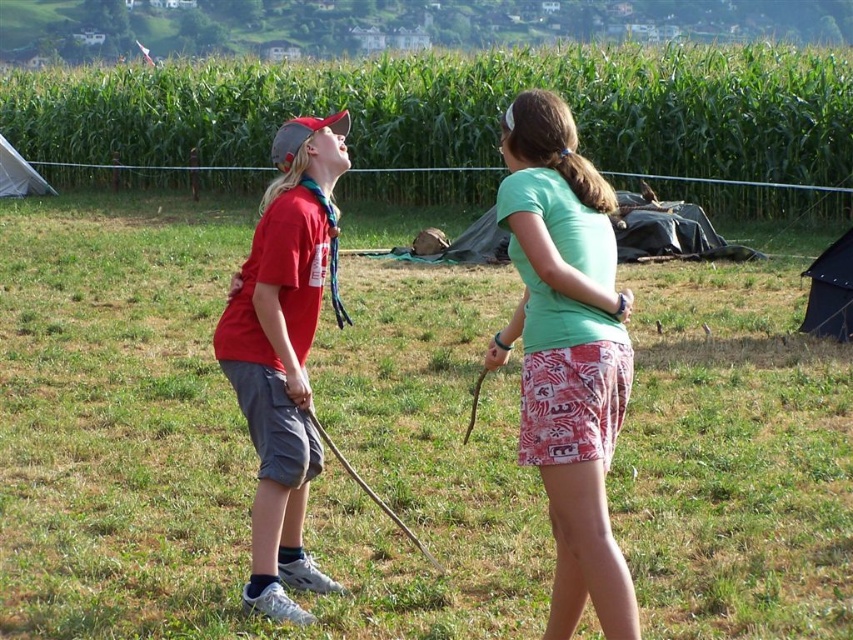
You are a photographer trying to capture a photo of both the green fabric shorts at center and the matte red shirt at left. Since you want them both in the frame, which direction should you move to ensure both are visible?

You should move to the left side because the green fabric shorts at center is positioned on the right side of matte red shirt at left, so moving left would allow both to be in the frame.

You are a photographer trying to capture both the green fabric shorts at center and the matte red shirt at left in a single frame. Which object should you focus on first to ensure both are in the frame?

The green fabric shorts at center is bigger than matte red shirt at left, so you should focus on the matte red shirt at left first to ensure both are in the frame.